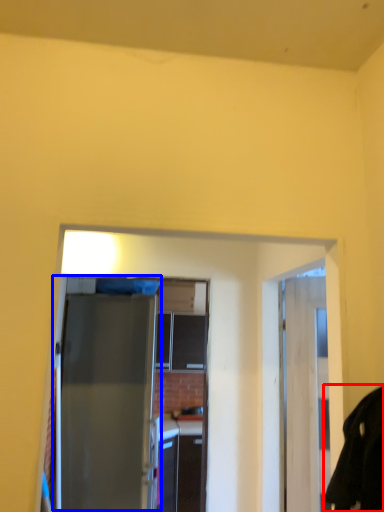
Question: Which point is further to the camera, robe (highlighted by a red box) or door (highlighted by a blue box)?

Choices:
 (A) robe
 (B) door

Answer: (B)